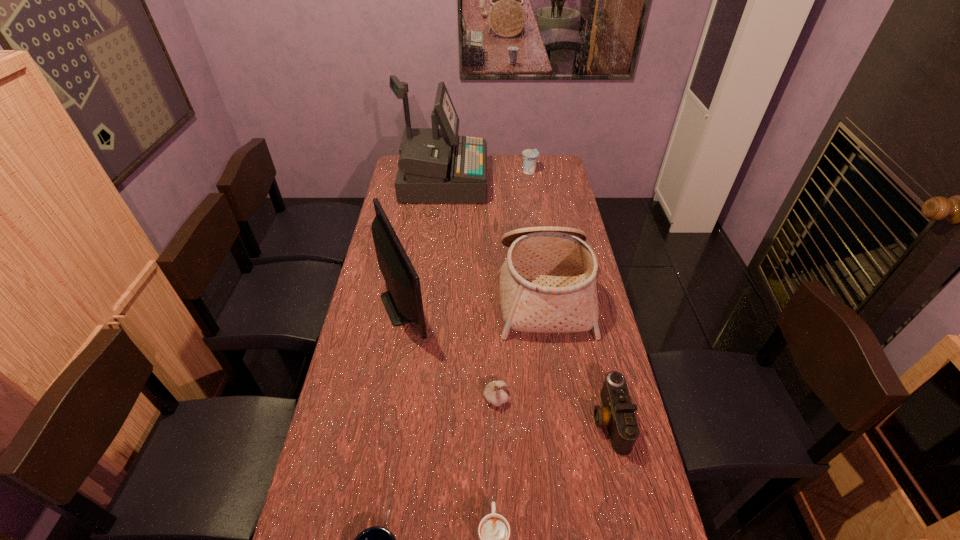
Locate an element on the screen. This screenshot has height=540, width=960. cash register is located at coordinates (436, 165).

At what (x,y) coordinates should I click in order to perform the action: click on computer monitor. Please return your answer as a coordinate pair (x, y). Looking at the image, I should click on (403, 302).

This screenshot has width=960, height=540. I want to click on the third tallest object, so click(547, 284).

Where is `yogurt`? Image resolution: width=960 pixels, height=540 pixels. yogurt is located at coordinates (x=530, y=156).

Find the location of a particular element. Image resolution: width=960 pixels, height=540 pixels. camera is located at coordinates (617, 413).

This screenshot has height=540, width=960. What are the coordinates of `garlic` in the screenshot? It's located at (494, 393).

At what (x,y) coordinates should I click in order to perform the action: click on vacant space situated 0.250m on the customer-facing side of the tallest object. Please return your answer as a coordinate pair (x, y). Looking at the image, I should click on (539, 181).

Locate an element on the screen. vacant space located on the front-facing side of the computer monitor is located at coordinates (542, 305).

At what (x,y) coordinates should I click in order to perform the action: click on free space located with the lid open on the basket. Please return your answer as a coordinate pair (x, y). This screenshot has width=960, height=540. Looking at the image, I should click on (430, 291).

Locate an element on the screen. This screenshot has width=960, height=540. free space located with the lid open on the basket is located at coordinates (471, 291).